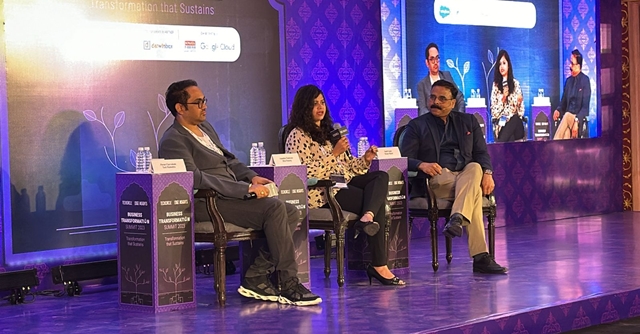
This screenshot has width=640, height=334. I want to click on chair, so click(x=220, y=252), click(x=344, y=224), click(x=434, y=220), click(x=584, y=127).